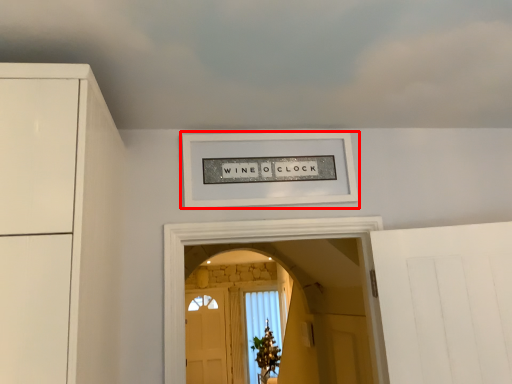
Question: From the image's perspective, what is the correct spatial positioning of picture frame (annotated by the red box) in reference to cloud?

Choices:
 (A) below
 (B) above

Answer: (A)